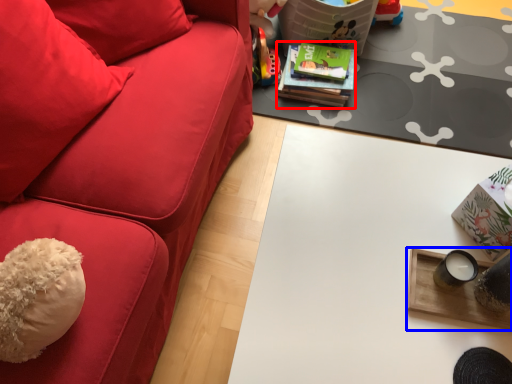
Question: Which object appears closest to the camera in this image, magazine (highlighted by a red box) or table (highlighted by a blue box)?

Choices:
 (A) magazine
 (B) table

Answer: (B)